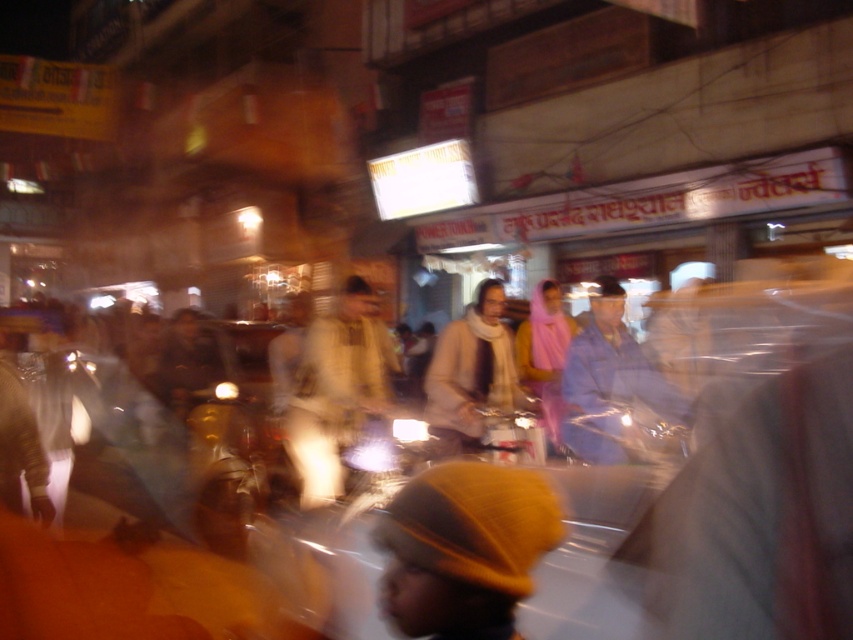
Is blue fabric jacket at center to the left of white woolen scarf at center from the viewer's perspective?

No, blue fabric jacket at center is not to the left of white woolen scarf at center.

What do you see at coordinates (608, 381) in the screenshot? I see `blue fabric jacket at center` at bounding box center [608, 381].

Which is in front, point (614, 355) or point (447, 372)?

Point (614, 355)

I want to click on blue fabric jacket at center, so click(608, 381).

Between light beige fabric at center and white woolen scarf at center, which one appears on the right side from the viewer's perspective?

white woolen scarf at center is more to the right.

Describe the element at coordinates (335, 390) in the screenshot. This screenshot has width=853, height=640. I see `light beige fabric at center` at that location.

Identify the location of light beige fabric at center. (335, 390).

Based on the photo, between light beige fabric at center and blue fabric jacket at center, which one has more height?

light beige fabric at center

Based on the photo, is light beige fabric at center wider than blue fabric jacket at center?

In fact, light beige fabric at center might be narrower than blue fabric jacket at center.

Which is in front, point (376, 360) or point (579, 413)?

Point (579, 413) is in front.

Locate an element on the screen. light beige fabric at center is located at coordinates (335, 390).